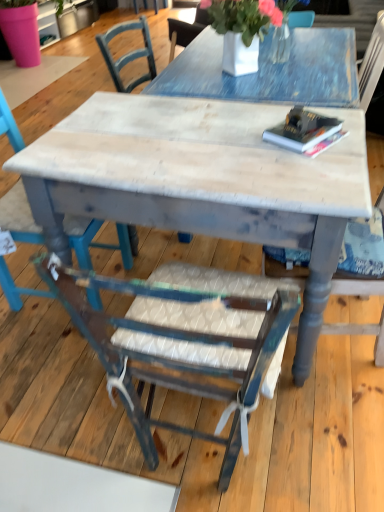
Identify the location of unoccupied area in front of hardcover book at upper right. (315, 167).